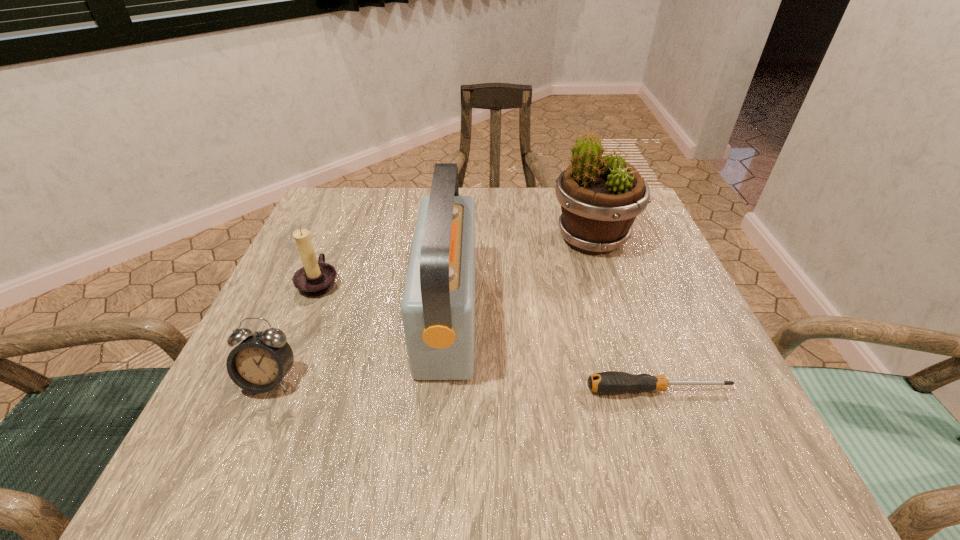
The height and width of the screenshot is (540, 960). What are the coordinates of `vacant space that is in between the second shortest object and the screwdriver` in the screenshot? It's located at (464, 385).

Choose which object is the third nearest neighbor to the third object from left to right. Please provide its 2D coordinates. Your answer should be formatted as a tuple, i.e. [(x, y)], where the tuple contains the x and y coordinates of a point satisfying the conditions above.

[(610, 382)]

Locate which object ranks third in proximity to the flowerpot. Please provide its 2D coordinates. Your answer should be formatted as a tuple, i.e. [(x, y)], where the tuple contains the x and y coordinates of a point satisfying the conditions above.

[(315, 278)]

The image size is (960, 540). Identify the location of vacant space that satisfies the following two spatial constraints: 1. on the front-facing side of the radio receiver; 2. on the face of the alarm clock. (443, 380).

Find the location of a particular element. Image resolution: width=960 pixels, height=540 pixels. free space that satisfies the following two spatial constraints: 1. on the front-facing side of the radio receiver; 2. on the face of the alarm clock is located at coordinates (443, 380).